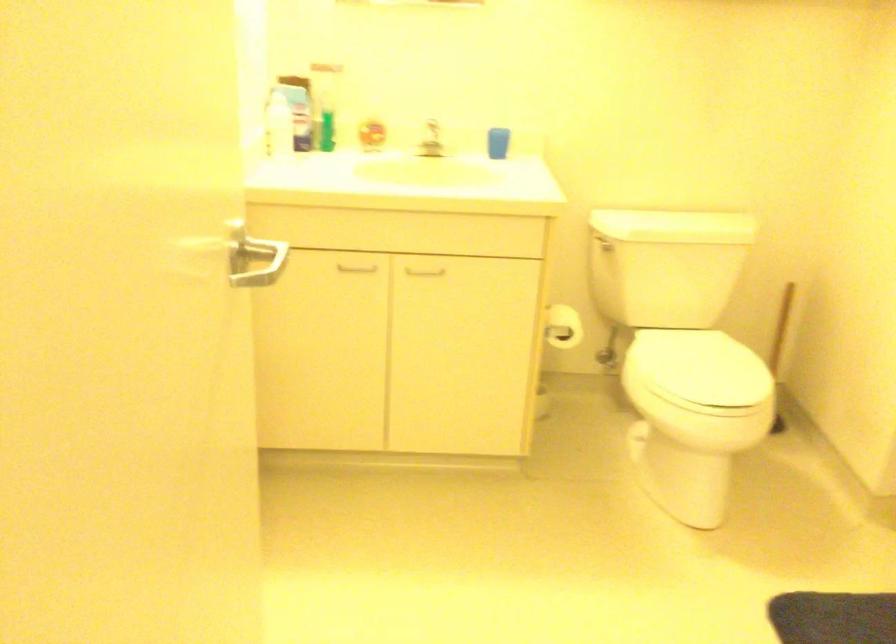
What do you see at coordinates (696, 368) in the screenshot?
I see `a toilet lid` at bounding box center [696, 368].